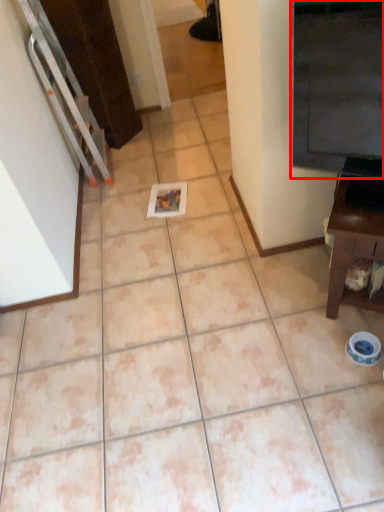
Question: From the image's perspective, considering the relative positions of fridge (annotated by the red box) and furniture in the image provided, where is fridge (annotated by the red box) located with respect to the staircase?

Choices:
 (A) above
 (B) below

Answer: (A)